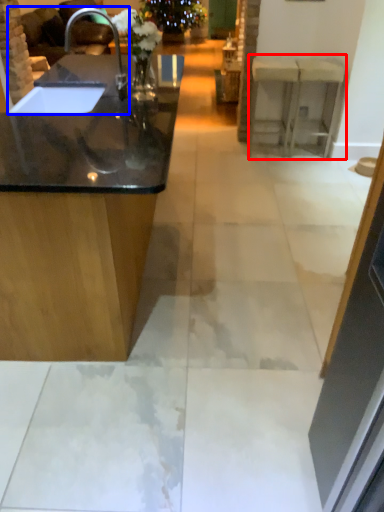
Question: Which point is further to the camera, counter (highlighted by a red box) or sink (highlighted by a blue box)?

Choices:
 (A) counter
 (B) sink

Answer: (A)